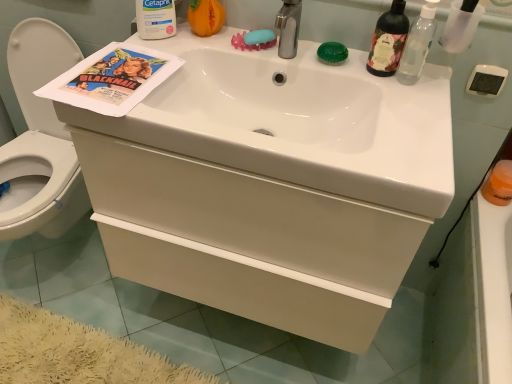
In order to click on vacant space situated on the left part of blue rubber soap at upper center, which ranks as the 2th soap in right-to-left order in this screenshot , I will do `click(191, 34)`.